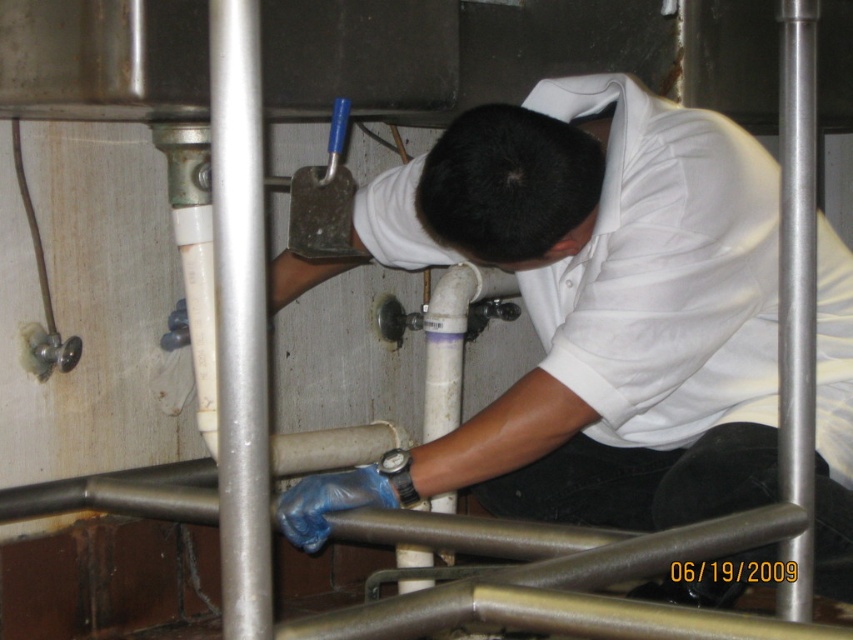
Between white matte shirt at center and brushed metal pipe at center left, which one has more height?

Standing taller between the two is white matte shirt at center.

Who is shorter, white matte shirt at center or brushed metal pipe at center left?

With less height is brushed metal pipe at center left.

Find the location of a particular element. The height and width of the screenshot is (640, 853). white matte shirt at center is located at coordinates (592, 308).

Locate an element on the screen. Image resolution: width=853 pixels, height=640 pixels. white matte shirt at center is located at coordinates (592, 308).

Between brushed metal pipe at center left and brushed metal pipe at center right, which one has less height?

With less height is brushed metal pipe at center left.

Can you confirm if brushed metal pipe at center left is taller than brushed metal pipe at center right?

In fact, brushed metal pipe at center left may be shorter than brushed metal pipe at center right.

Is point (233, 65) farther from viewer compared to point (804, 461)?

No.

Find the location of a particular element. brushed metal pipe at center left is located at coordinates [x=241, y=317].

Can you confirm if white matte shirt at center is shorter than brushed metal pipe at center right?

Indeed, white matte shirt at center has a lesser height compared to brushed metal pipe at center right.

From the picture: Which of these two, white matte shirt at center or brushed metal pipe at center right, stands taller?

Standing taller between the two is brushed metal pipe at center right.

Who is more forward, [753,220] or [793,16]?

Positioned in front is point [793,16].

Where is `white matte shirt at center`? Image resolution: width=853 pixels, height=640 pixels. white matte shirt at center is located at coordinates (592, 308).